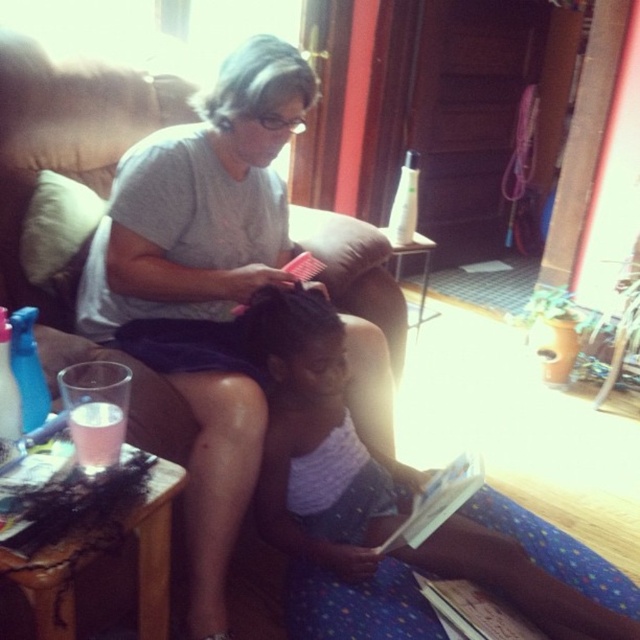
Question: Can you confirm if matte gray shirt at center is bigger than pink fabric dress at center?

Choices:
 (A) no
 (B) yes

Answer: (B)

Question: Among these points, which one is farthest from the camera?

Choices:
 (A) (323, 570)
 (B) (77, 218)

Answer: (B)

Question: Which point is farther to the camera?

Choices:
 (A) matte gray shirt at center
 (B) pink fabric dress at center

Answer: (A)

Question: Can you confirm if pink fabric dress at center is thinner than white fabric pillow at left?

Choices:
 (A) yes
 (B) no

Answer: (B)

Question: Based on their relative distances, which object is nearer to the matte gray shirt at center?

Choices:
 (A) white fabric pillow at left
 (B) pink fabric dress at center

Answer: (B)

Question: Is pink fabric dress at center to the right of white fabric pillow at left from the viewer's perspective?

Choices:
 (A) yes
 (B) no

Answer: (A)